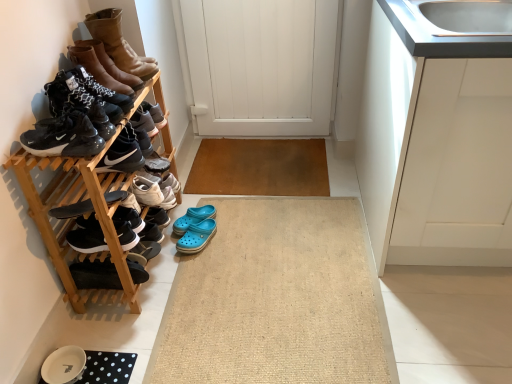
Question: Considering the relative sizes of wooden shoe rack at left and beige woven bath mat at center in the image provided, is wooden shoe rack at left taller than beige woven bath mat at center?

Choices:
 (A) no
 (B) yes

Answer: (B)

Question: Can you confirm if wooden shoe rack at left is wider than beige woven bath mat at center?

Choices:
 (A) no
 (B) yes

Answer: (A)

Question: Is wooden shoe rack at left not within beige woven bath mat at center?

Choices:
 (A) no
 (B) yes

Answer: (B)

Question: Can you confirm if wooden shoe rack at left is bigger than beige woven bath mat at center?

Choices:
 (A) yes
 (B) no

Answer: (A)

Question: Is the depth of wooden shoe rack at left greater than that of beige woven bath mat at center?

Choices:
 (A) no
 (B) yes

Answer: (A)

Question: Does wooden shoe rack at left come in front of beige woven bath mat at center?

Choices:
 (A) yes
 (B) no

Answer: (A)

Question: Is beige woven bath mat at center positioned behind blue rubber clogs at center, which is the second footwear in bottom-to-top order?

Choices:
 (A) yes
 (B) no

Answer: (B)

Question: Is beige woven bath mat at center positioned far away from blue rubber clogs at center, the seventh footwear positioned from the top?

Choices:
 (A) no
 (B) yes

Answer: (A)

Question: From the image's perspective, is beige woven bath mat at center below blue rubber clogs at center, which is the second footwear in bottom-to-top order?

Choices:
 (A) yes
 (B) no

Answer: (A)

Question: Is beige woven bath mat at center shorter than blue rubber clogs at center, which is the second footwear in bottom-to-top order?

Choices:
 (A) yes
 (B) no

Answer: (A)

Question: Can you confirm if beige woven bath mat at center is taller than blue rubber clogs at center, the seventh footwear positioned from the top?

Choices:
 (A) no
 (B) yes

Answer: (A)

Question: From a real-world perspective, is beige woven bath mat at center beneath blue rubber clogs at center, which is the second footwear in bottom-to-top order?

Choices:
 (A) yes
 (B) no

Answer: (A)